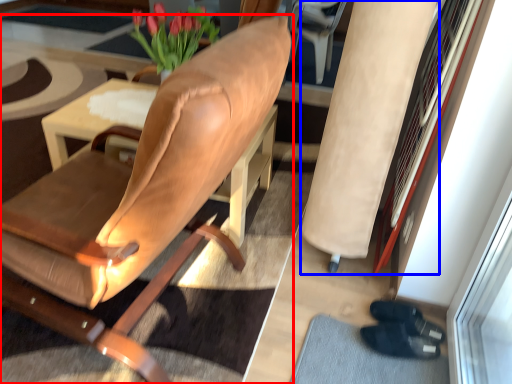
Question: Among these objects, which one is farthest to the camera, chair (highlighted by a red box) or beige (highlighted by a blue box)?

Choices:
 (A) chair
 (B) beige

Answer: (B)